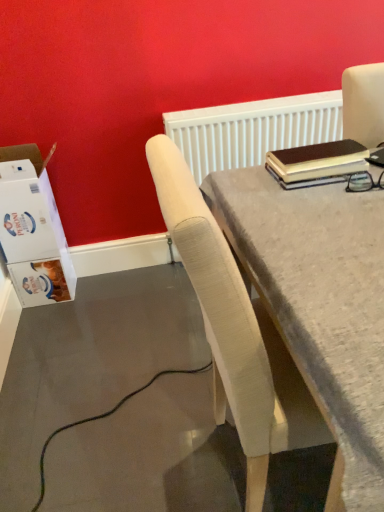
Question: From a real-world perspective, is white textured radiator at upper center positioned above or below light beige fabric chair at center?

Choices:
 (A) above
 (B) below

Answer: (A)

Question: Visually, is white textured radiator at upper center positioned to the left or to the right of light beige fabric chair at center?

Choices:
 (A) right
 (B) left

Answer: (B)

Question: Which object is positioned closest to the white cardboard box at left?

Choices:
 (A) light beige fabric chair at center
 (B) white textured radiator at upper center

Answer: (B)

Question: Considering the real-world distances, which object is closest to the light beige fabric chair at center?

Choices:
 (A) white cardboard box at left
 (B) white textured radiator at upper center

Answer: (B)